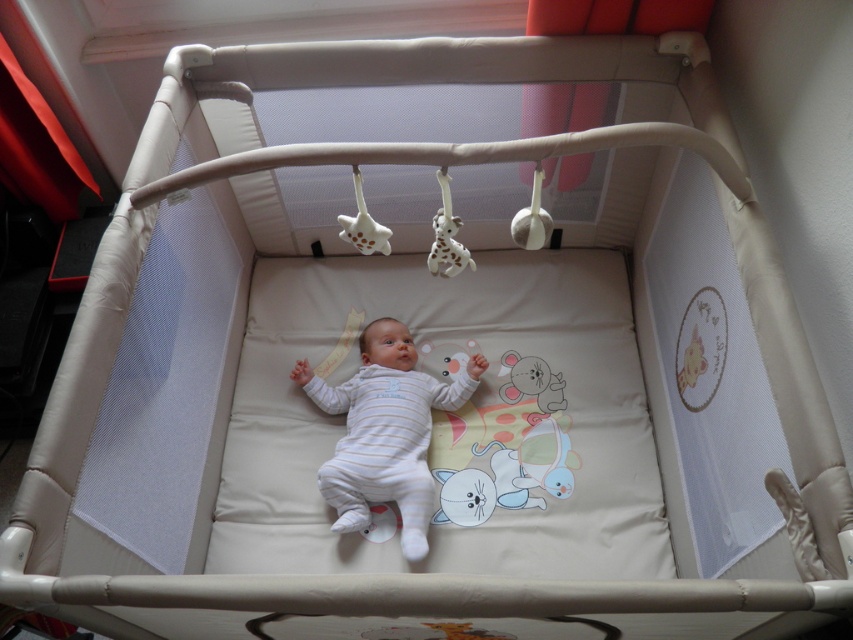
You are a caregiver checking the playpen setup. The playpen has a width limit of 60 cm for safety. The white soft baby at center and the white matte giraffe at upper center are both within the playpen. Can you determine if the baby is wider than the giraffe?

The white soft baby at center might be wider than white matte giraffe at upper center according to the description, so there is a possibility that the baby exceeds the 60 cm width limit. Further measurement is needed to confirm.

You are a parent checking if your baby can reach the toys. The baby is in the playpen. Can the baby touch the white spotted plastic giraffe at upper center while lying on the white soft baby at center?

The white spotted plastic giraffe at upper center is behind the white soft baby at center, so the baby cannot reach it while lying on the white soft baby at center.

You are a caregiver checking on the baby in the playpen. You notice the white soft baby at center and the white matte giraffe at upper center. Which object is located higher in the image?

The white matte giraffe at upper center is located higher in the image than the white soft baby at center.